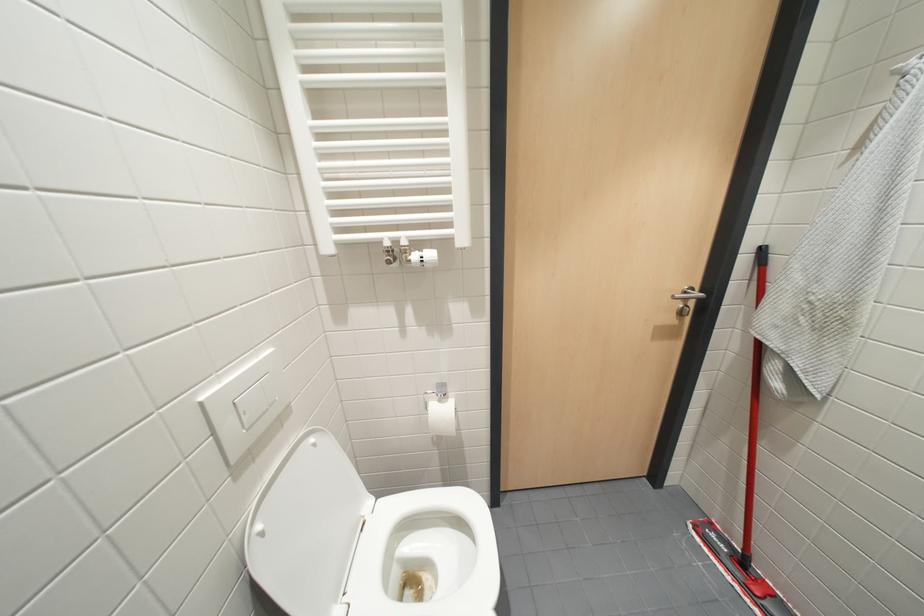
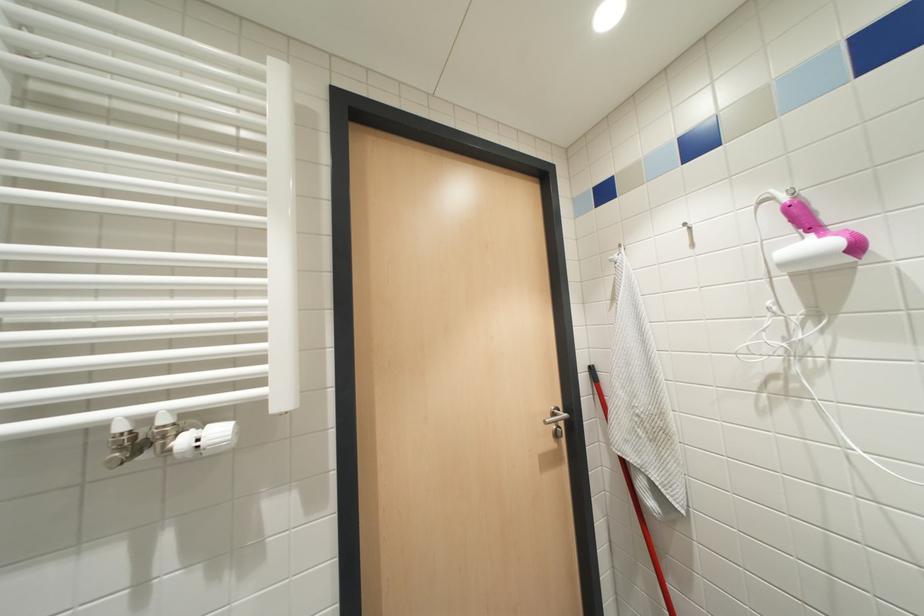
Based on the continuous images, in which direction is the camera rotating?

The rotation direction of the camera is right-up.